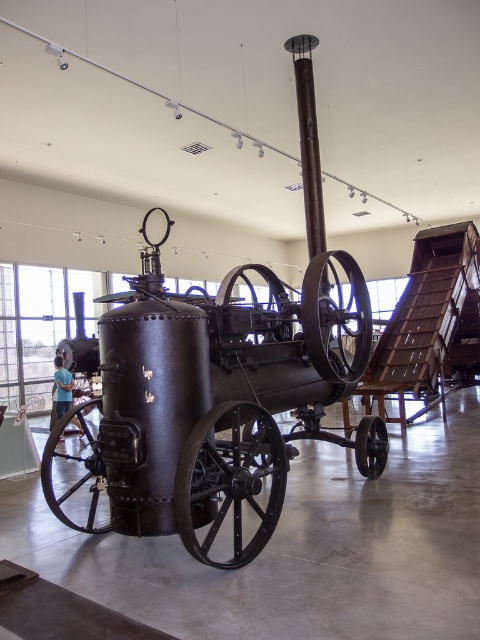
Question: Is matte black steam engine at center above blue shirt at lower left?

Choices:
 (A) no
 (B) yes

Answer: (B)

Question: Is matte black steam engine at center in front of blue shirt at lower left?

Choices:
 (A) no
 (B) yes

Answer: (B)

Question: Among these objects, which one is farthest from the camera?

Choices:
 (A) blue shirt at lower left
 (B) matte black steam engine at center

Answer: (A)

Question: Does matte black steam engine at center appear under blue shirt at lower left?

Choices:
 (A) yes
 (B) no

Answer: (B)

Question: Which object appears closest to the camera in this image?

Choices:
 (A) matte black steam engine at center
 (B) blue shirt at lower left

Answer: (A)